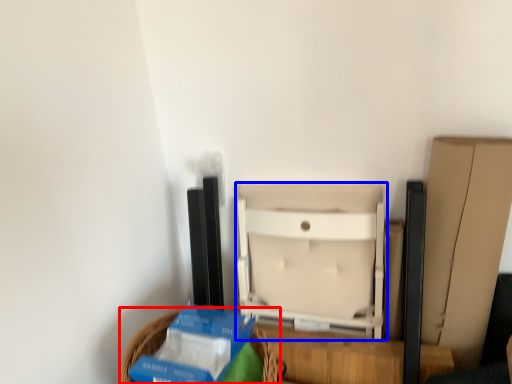
Question: Among these objects, which one is nearest to the camera, basket (highlighted by a red box) or furniture (highlighted by a blue box)?

Choices:
 (A) basket
 (B) furniture

Answer: (A)